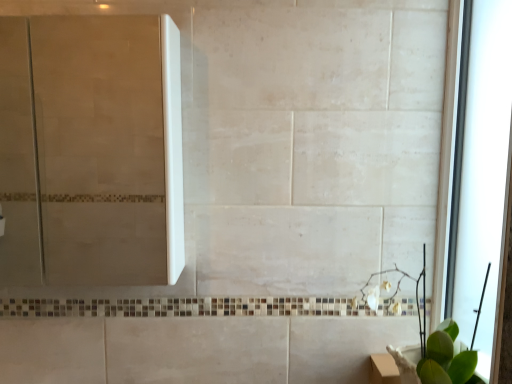
Question: Is white glossy screen door at upper left located outside green leafy plant at lower right?

Choices:
 (A) yes
 (B) no

Answer: (A)

Question: Can you confirm if white glossy screen door at upper left is smaller than green leafy plant at lower right?

Choices:
 (A) no
 (B) yes

Answer: (A)

Question: Considering the relative sizes of white glossy screen door at upper left and green leafy plant at lower right in the image provided, is white glossy screen door at upper left taller than green leafy plant at lower right?

Choices:
 (A) no
 (B) yes

Answer: (B)

Question: From a real-world perspective, does white glossy screen door at upper left stand above green leafy plant at lower right?

Choices:
 (A) yes
 (B) no

Answer: (A)

Question: From the image's perspective, is white glossy screen door at upper left on green leafy plant at lower right?

Choices:
 (A) no
 (B) yes

Answer: (B)

Question: In terms of height, does transparent glass window at right look taller or shorter compared to white glossy screen door at upper left?

Choices:
 (A) short
 (B) tall

Answer: (B)

Question: From a real-world perspective, is transparent glass window at right positioned above or below white glossy screen door at upper left?

Choices:
 (A) below
 (B) above

Answer: (A)

Question: From the image's perspective, relative to white glossy screen door at upper left, is transparent glass window at right above or below?

Choices:
 (A) above
 (B) below

Answer: (B)

Question: Would you say transparent glass window at right is inside or outside white glossy screen door at upper left?

Choices:
 (A) outside
 (B) inside

Answer: (A)

Question: From a real-world perspective, is green leafy plant at lower right above or below white glossy screen door at upper left?

Choices:
 (A) above
 (B) below

Answer: (B)

Question: Looking at their shapes, would you say green leafy plant at lower right is wider or thinner than white glossy screen door at upper left?

Choices:
 (A) thin
 (B) wide

Answer: (B)

Question: Is point [460, 367] positioned closer to the camera than point [123, 33]?

Choices:
 (A) closer
 (B) farther

Answer: (A)

Question: Looking at the image, does green leafy plant at lower right seem bigger or smaller compared to white glossy screen door at upper left?

Choices:
 (A) big
 (B) small

Answer: (B)

Question: Is white glossy screen door at upper left wider or thinner than green leafy plant at lower right?

Choices:
 (A) thin
 (B) wide

Answer: (A)

Question: From a real-world perspective, is white glossy screen door at upper left positioned above or below green leafy plant at lower right?

Choices:
 (A) below
 (B) above

Answer: (B)